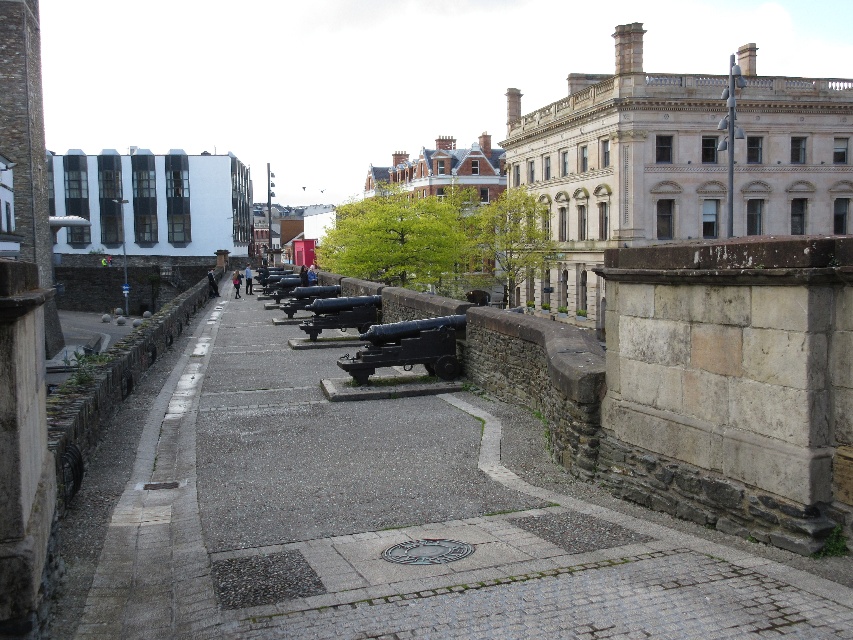
Consider the image. You are a tour guide leading visitors along the cobblestone pathway. You want to point out the polished bronze cannon at center to your group. Which side of the stone paved path at center should you direct their attention to?

The polished bronze cannon at center is to the left of the stone paved path at center, so you should direct their attention to the left side of the stone paved path at center.